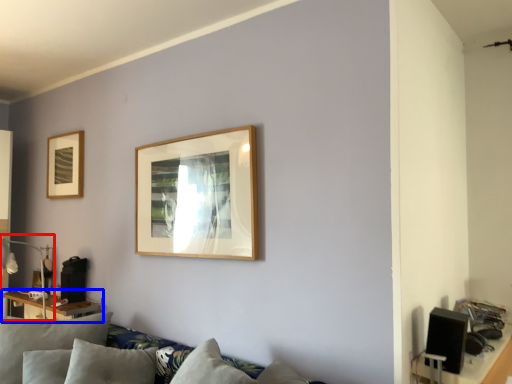
Question: Which point is closer to the camera, lamp (highlighted by a red box) or table (highlighted by a blue box)?

Choices:
 (A) lamp
 (B) table

Answer: (A)